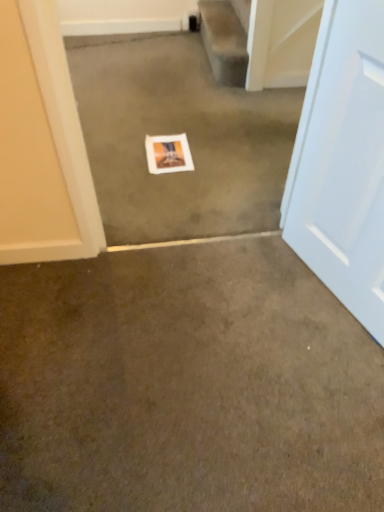
This screenshot has width=384, height=512. What do you see at coordinates (224, 42) in the screenshot? I see `smooth beige carpet at upper center` at bounding box center [224, 42].

The height and width of the screenshot is (512, 384). What do you see at coordinates (343, 162) in the screenshot?
I see `white glossy door at right` at bounding box center [343, 162].

Locate an element on the screen. brown carpet at center, which is counted as the first concrete, starting from the bottom is located at coordinates (x=186, y=385).

Are white matte picture frame at center and smooth beige carpet at upper center beside each other?

They are not placed beside each other.

Can you confirm if white matte picture frame at center is wider than smooth beige carpet at upper center?

Yes.

Is white matte picture frame at center situated inside smooth beige carpet at upper center or outside?

white matte picture frame at center cannot be found inside smooth beige carpet at upper center.

Does point (193, 167) appear closer or farther from the camera than point (230, 74)?

Point (193, 167) appears to be closer to the viewer than point (230, 74).

This screenshot has height=512, width=384. Identify the location of picture frame lying on the left of white glossy door at right. (168, 154).

Does white matte picture frame at center contain white glossy door at right?

No.

Considering the relative sizes of white matte picture frame at center and white glossy door at right in the image provided, is white matte picture frame at center shorter than white glossy door at right?

Correct, white matte picture frame at center is not as tall as white glossy door at right.

Are white matte picture frame at center and white glossy door at right beside each other?

white matte picture frame at center and white glossy door at right are not in contact.

How much distance is there between white glossy door at right and brown carpet at center, which is counted as the first concrete, starting from the bottom?

20.49 inches.

Is white glossy door at right situated inside brown carpet at center, which is counted as the first concrete, starting from the bottom, or outside?

white glossy door at right cannot be found inside brown carpet at center, which is counted as the first concrete, starting from the bottom.

Is white glossy door at right turned away from brown carpet at center, which is counted as the first concrete, starting from the bottom?

No, white glossy door at right is not facing the opposite direction of brown carpet at center, which is counted as the first concrete, starting from the bottom.

Which object is positioned more to the right, white glossy door at right or smooth beige carpet at upper center?

white glossy door at right.

From a real-world perspective, is white glossy door at right above or below smooth beige carpet at upper center?

white glossy door at right is above smooth beige carpet at upper center.

Considering the relative sizes of white glossy door at right and smooth beige carpet at upper center in the image provided, is white glossy door at right taller than smooth beige carpet at upper center?

Yes.

Is brown carpet at center, which is counted as the first concrete, starting from the bottom, not inside white paper at center, the 1th concrete when ordered from top to bottom?

That's correct, brown carpet at center, which is counted as the first concrete, starting from the bottom, is outside of white paper at center, the 1th concrete when ordered from top to bottom.

From a real-world perspective, between brown carpet at center, which is counted as the first concrete, starting from the bottom, and white paper at center, the 1th concrete when ordered from top to bottom, who is vertically higher?

From a 3D spatial view, white paper at center, the 1th concrete when ordered from top to bottom, is above.

Which is more to the right, brown carpet at center, the second concrete viewed from the top, or white paper at center, the 1th concrete when ordered from top to bottom?

white paper at center, the 1th concrete when ordered from top to bottom, is more to the right.

Looking at this image, is brown carpet at center, which is counted as the first concrete, starting from the bottom, directly adjacent to white paper at center, the 1th concrete when ordered from top to bottom?

No, brown carpet at center, which is counted as the first concrete, starting from the bottom, is not touching white paper at center, the 1th concrete when ordered from top to bottom.

From the image's perspective, between white matte picture frame at center and white paper at center, marked as the 2th concrete in a bottom-to-top arrangement, which one is located above?

white matte picture frame at center is shown above in the image.

Are white matte picture frame at center and white paper at center, the 1th concrete when ordered from top to bottom, far apart?

That's not correct — white matte picture frame at center is a little close to white paper at center, the 1th concrete when ordered from top to bottom.

Which of these two, white matte picture frame at center or white paper at center, the 1th concrete when ordered from top to bottom, is wider?

white matte picture frame at center.

From a real-world perspective, who is located higher, white matte picture frame at center or white paper at center, marked as the 2th concrete in a bottom-to-top arrangement?

Result: white paper at center, marked as the 2th concrete in a bottom-to-top arrangement, from a real-world perspective.

Considering the positions of point (158, 169) and point (56, 334), is point (158, 169) closer or farther from the camera than point (56, 334)?

Point (158, 169) is farther from the camera than point (56, 334).

Where is `picture frame located above the brown carpet at center, the second concrete viewed from the top (from a real-world perspective)`? This screenshot has width=384, height=512. picture frame located above the brown carpet at center, the second concrete viewed from the top (from a real-world perspective) is located at coordinates (168, 154).

Between white matte picture frame at center and brown carpet at center, the second concrete viewed from the top, which one has larger width?

Wider between the two is brown carpet at center, the second concrete viewed from the top.

Are white matte picture frame at center and brown carpet at center, the second concrete viewed from the top, beside each other?

No, white matte picture frame at center is not in contact with brown carpet at center, the second concrete viewed from the top.

At what (x,y) coordinates should I click in order to perform the action: click on stairwell above the white matte picture frame at center (from the image's perspective). Please return your answer as a coordinate pair (x, y). The width and height of the screenshot is (384, 512). Looking at the image, I should click on (224, 42).

At what (x,y) coordinates should I click in order to perform the action: click on door located below the white matte picture frame at center (from the image's perspective). Please return your answer as a coordinate pair (x, y). The height and width of the screenshot is (512, 384). Looking at the image, I should click on (343, 162).

Based on the photo, based on their spatial positions, is white paper at center, the 1th concrete when ordered from top to bottom, or smooth beige carpet at upper center closer to white glossy door at right?

white paper at center, the 1th concrete when ordered from top to bottom, lies closer to white glossy door at right than the other object.

Estimate the real-world distances between objects in this image. Which object is closer to smooth beige carpet at upper center, white glossy door at right or white matte picture frame at center?

white matte picture frame at center is closer to smooth beige carpet at upper center.

Based on their spatial positions, is smooth beige carpet at upper center or brown carpet at center, the second concrete viewed from the top, further from white paper at center, the 1th concrete when ordered from top to bottom?

brown carpet at center, the second concrete viewed from the top.

From the image, which object appears to be nearer to white paper at center, marked as the 2th concrete in a bottom-to-top arrangement, white matte picture frame at center or smooth beige carpet at upper center?

Based on the image, white matte picture frame at center appears to be nearer to white paper at center, marked as the 2th concrete in a bottom-to-top arrangement.

When comparing their distances from white paper at center, marked as the 2th concrete in a bottom-to-top arrangement, does white matte picture frame at center or white glossy door at right seem closer?

white matte picture frame at center is positioned closer to the anchor white paper at center, marked as the 2th concrete in a bottom-to-top arrangement.

When comparing their distances from white matte picture frame at center, does smooth beige carpet at upper center or white paper at center, the 1th concrete when ordered from top to bottom, seem closer?

The object closer to white matte picture frame at center is white paper at center, the 1th concrete when ordered from top to bottom.

When comparing their distances from white glossy door at right, does smooth beige carpet at upper center or brown carpet at center, which is counted as the first concrete, starting from the bottom, seem further?

smooth beige carpet at upper center.

From the image, which object appears to be farther from brown carpet at center, which is counted as the first concrete, starting from the bottom, white matte picture frame at center or smooth beige carpet at upper center?

smooth beige carpet at upper center lies further to brown carpet at center, which is counted as the first concrete, starting from the bottom, than the other object.

Find the location of a particular element. picture frame located between white glossy door at right and smooth beige carpet at upper center in the depth direction is located at coordinates (168, 154).

Image resolution: width=384 pixels, height=512 pixels. In order to click on door between smooth beige carpet at upper center and brown carpet at center, the second concrete viewed from the top, in the up-down direction in this screenshot , I will do `click(343, 162)`.

Find the location of a particular element. door between white paper at center, marked as the 2th concrete in a bottom-to-top arrangement, and brown carpet at center, which is counted as the first concrete, starting from the bottom, vertically is located at coordinates (343, 162).

This screenshot has height=512, width=384. What are the coordinates of `concrete positioned between brown carpet at center, which is counted as the first concrete, starting from the bottom, and white matte picture frame at center from near to far` in the screenshot? It's located at (176, 133).